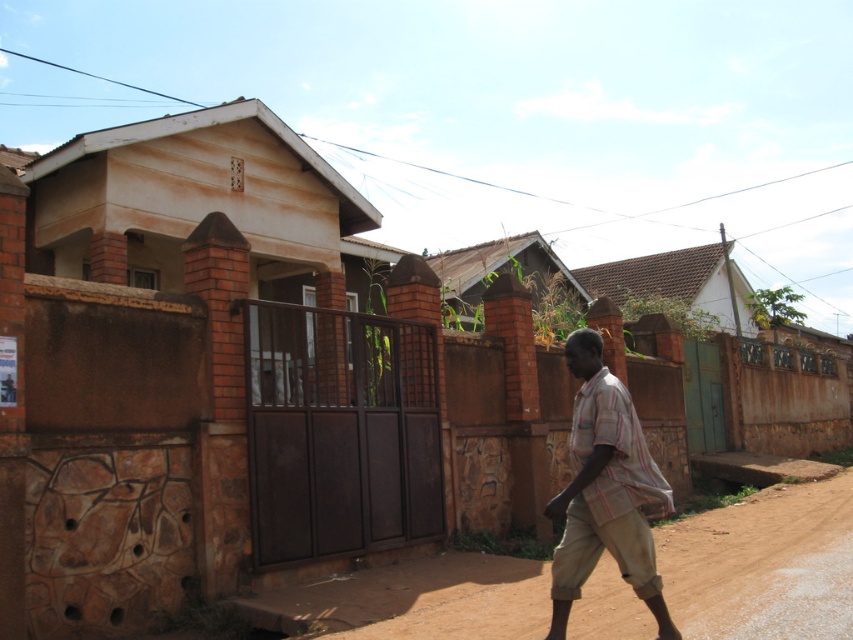
Question: Which object is closer to the camera taking this photo?

Choices:
 (A) striped cotton shirt at center
 (B) brown metal gate at center

Answer: (A)

Question: Is brown metal gate at center wider than striped cotton shirt at center?

Choices:
 (A) no
 (B) yes

Answer: (B)

Question: Which object is positioned closest to the brown dirt track at lower right?

Choices:
 (A) striped cotton shirt at center
 (B) brown metal gate at center

Answer: (B)

Question: Does brown metal gate at center have a smaller size compared to brown dirt track at lower right?

Choices:
 (A) no
 (B) yes

Answer: (B)

Question: Among these points, which one is nearest to the camera?

Choices:
 (A) (581, 432)
 (B) (815, 483)
 (C) (329, 416)

Answer: (A)

Question: Does brown dirt track at lower right lie in front of striped cotton shirt at center?

Choices:
 (A) yes
 (B) no

Answer: (B)